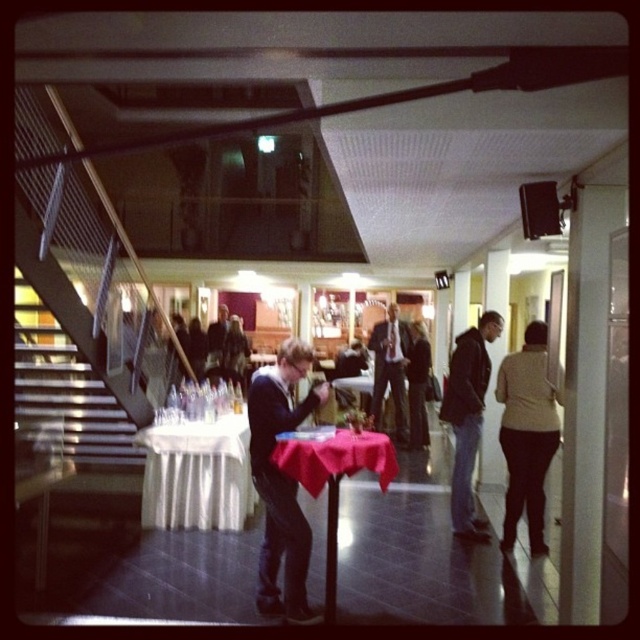
Between white satin tablecloth at left and beige sweater at right, which one is positioned higher?

Positioned higher is beige sweater at right.

Does point (234, 442) come farther from viewer compared to point (515, 413)?

Yes.

Find the location of a particular element. This screenshot has height=640, width=640. white satin tablecloth at left is located at coordinates (196, 474).

Find the location of a particular element. The height and width of the screenshot is (640, 640). white satin tablecloth at left is located at coordinates (196, 474).

Which is below, dark blue sweater at center or dark blue jeans at center?

dark blue sweater at center is lower down.

Can you confirm if dark blue sweater at center is positioned to the left of dark blue jeans at center?

Indeed, dark blue sweater at center is positioned on the left side of dark blue jeans at center.

Is point (294, 593) positioned after point (465, 483)?

That is False.

The width and height of the screenshot is (640, 640). I want to click on dark blue sweater at center, so click(282, 481).

Between dark blue sweater at center and smooth red tablecloth at center, which one has less height?

With less height is smooth red tablecloth at center.

Find the location of `dark blue sweater at center`. dark blue sweater at center is located at coordinates (282, 481).